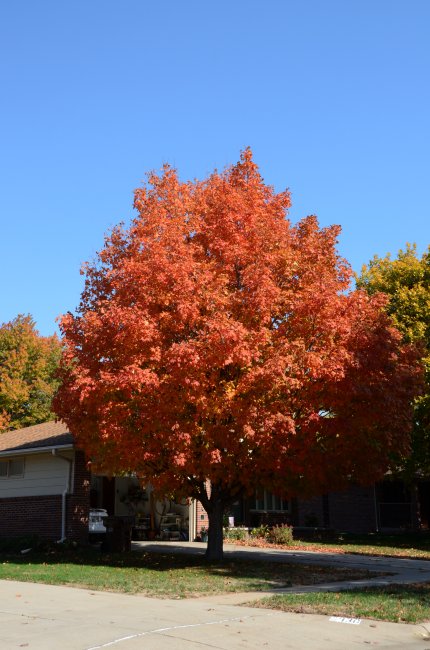
The width and height of the screenshot is (430, 650). In order to click on trash can in this screenshot , I will do `click(120, 525)`.